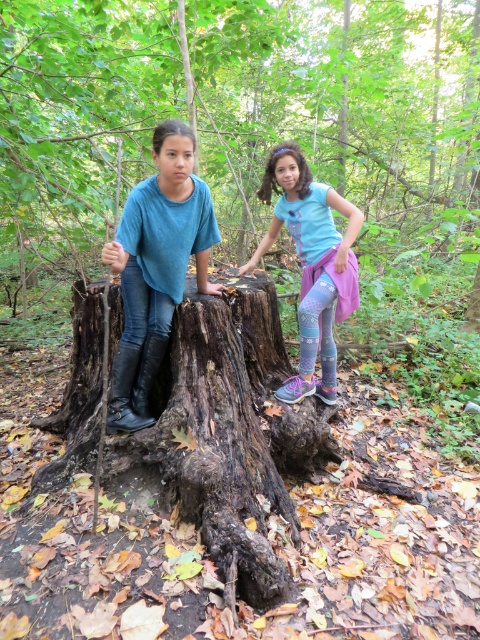
Between point (298, 538) and point (280, 388), which one is positioned behind?

The point (280, 388) is more distant.

This screenshot has height=640, width=480. Describe the element at coordinates (216, 440) in the screenshot. I see `dark brown rough tree trunk at center` at that location.

Where is `dark brown rough tree trunk at center`? dark brown rough tree trunk at center is located at coordinates (216, 440).

Can you confirm if matte blue shirt at center is positioned to the left of light blue t-shirt at center?

Yes, matte blue shirt at center is to the left of light blue t-shirt at center.

At what (x,y) coordinates should I click in order to perform the action: click on matte blue shirt at center. Please return your answer as a coordinate pair (x, y). This screenshot has width=480, height=640. Looking at the image, I should click on (156, 268).

Measure the distance between matte blue shirt at center and camera.

matte blue shirt at center and camera are 2.01 meters apart from each other.

Identify the location of matte blue shirt at center. (156, 268).

Between dark brown rough tree trunk at center and matte blue shirt at center, which one has more height?

With more height is matte blue shirt at center.

Where is `dark brown rough tree trunk at center`? This screenshot has height=640, width=480. dark brown rough tree trunk at center is located at coordinates (216, 440).